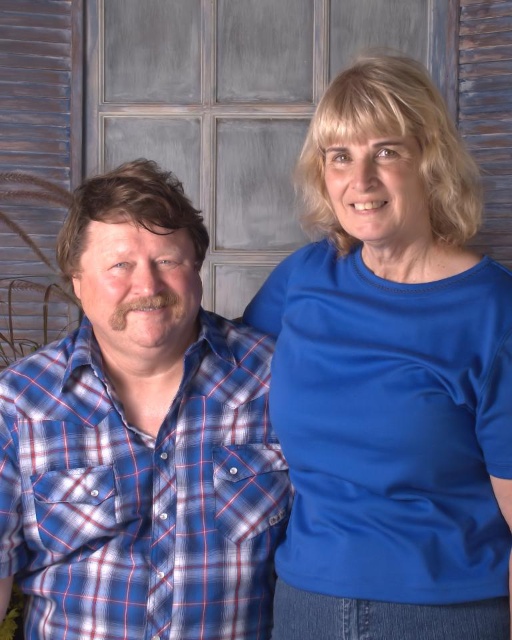
Does blue smooth shirt at upper right appear under blue plaid shirt at left?

No.

At what (x,y) coordinates should I click in order to perform the action: click on blue smooth shirt at upper right. Please return your answer as a coordinate pair (x, y). Looking at the image, I should click on (391, 378).

Identify the location of blue smooth shirt at upper right. The width and height of the screenshot is (512, 640). (391, 378).